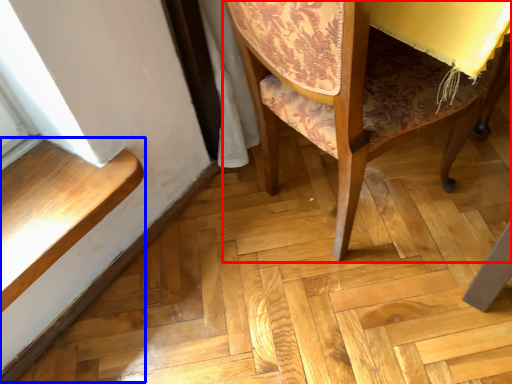
Question: Which point is closer to the camera, chair (highlighted by a red box) or stairwell (highlighted by a blue box)?

Choices:
 (A) chair
 (B) stairwell

Answer: (A)